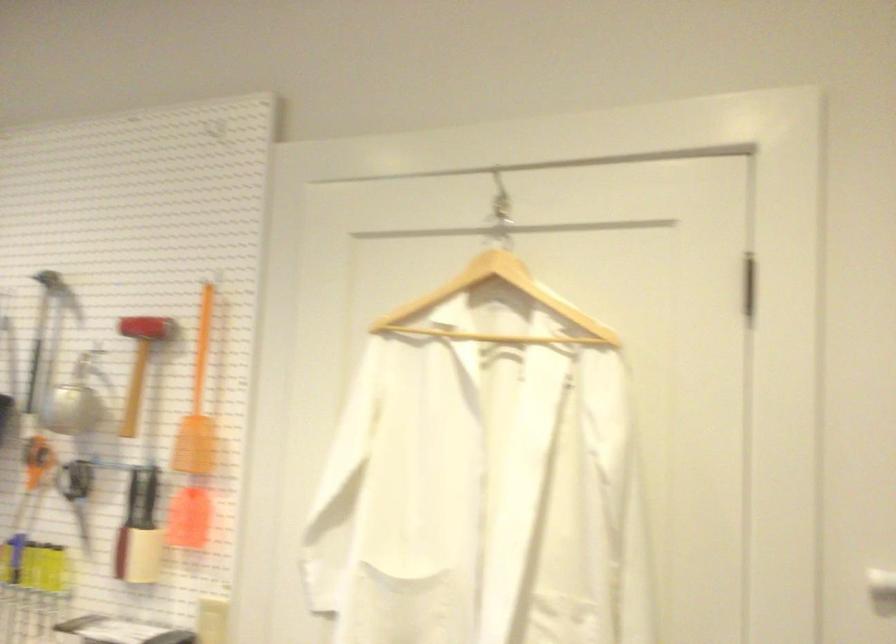
What do you see at coordinates (134, 391) in the screenshot?
I see `a mallet handle` at bounding box center [134, 391].